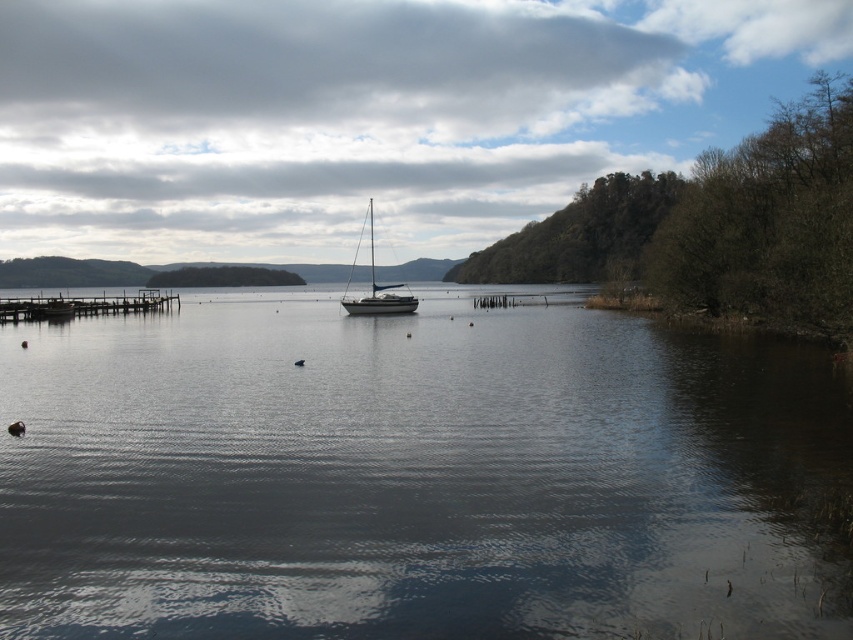
Is wooden pier at left wider than shiny black sailboat at center?

No.

The image size is (853, 640). What do you see at coordinates (80, 305) in the screenshot?
I see `wooden pier at left` at bounding box center [80, 305].

What are the coordinates of `wooden pier at left` in the screenshot? It's located at (80, 305).

Does dark reflective water at center lie behind shiny black sailboat at center?

No, it is not.

Can you confirm if dark reflective water at center is positioned below shiny black sailboat at center?

Yes, dark reflective water at center is below shiny black sailboat at center.

Locate an element on the screen. Image resolution: width=853 pixels, height=640 pixels. dark reflective water at center is located at coordinates (409, 474).

Where is `dark reflective water at center`? The image size is (853, 640). dark reflective water at center is located at coordinates (409, 474).

Between dark reflective water at center and wooden pier at left, which one is positioned lower?

Positioned lower is dark reflective water at center.

Between dark reflective water at center and wooden pier at left, which one has less height?

Standing shorter between the two is dark reflective water at center.

Which is in front, point (263, 355) or point (85, 308)?

Positioned in front is point (263, 355).

The height and width of the screenshot is (640, 853). I want to click on dark reflective water at center, so (409, 474).